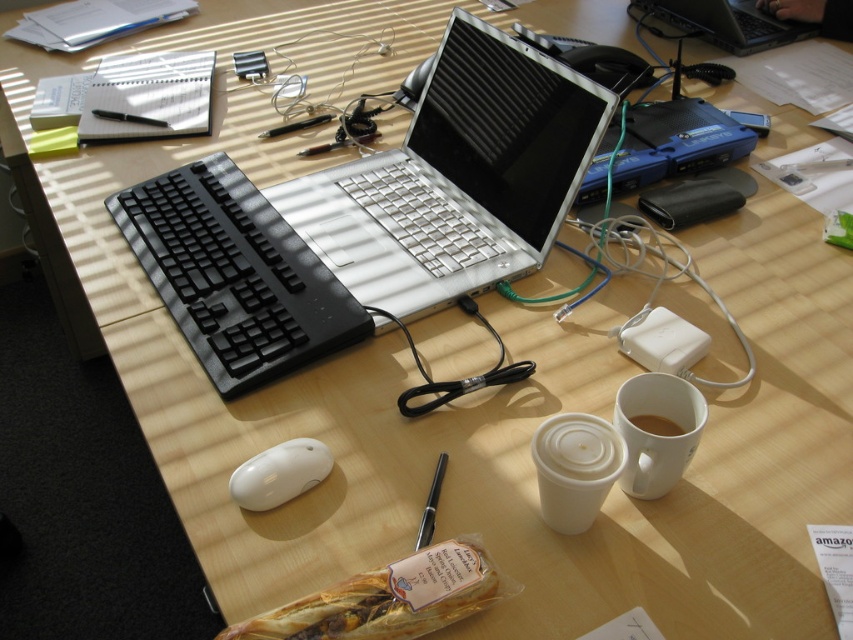
Which is above, translucent plastic baguette at center or white glossy mouse at center?

Positioned higher is white glossy mouse at center.

Between translucent plastic baguette at center and white glossy mouse at center, which one has more height?

translucent plastic baguette at center is taller.

Is point (486, 564) positioned in front of point (294, 460)?

Yes, it is.

The image size is (853, 640). I want to click on translucent plastic baguette at center, so click(x=387, y=600).

Between black rubberized keyboard at center-left and white matte cup at lower right, which one has more height?

black rubberized keyboard at center-left is taller.

Which is behind, point (305, 324) or point (683, 460)?

The point (305, 324) is more distant.

Is point (289, 324) farther from viewer compared to point (663, 404)?

Yes, it is behind point (663, 404).

In order to click on black rubberized keyboard at center-left in this screenshot , I will do `click(234, 275)`.

Which is behind, point (219, 260) or point (585, 529)?

The point (219, 260) is more distant.

Is point (157, 236) positioned after point (544, 444)?

Yes, it is.

I want to click on black rubberized keyboard at center-left, so click(x=234, y=275).